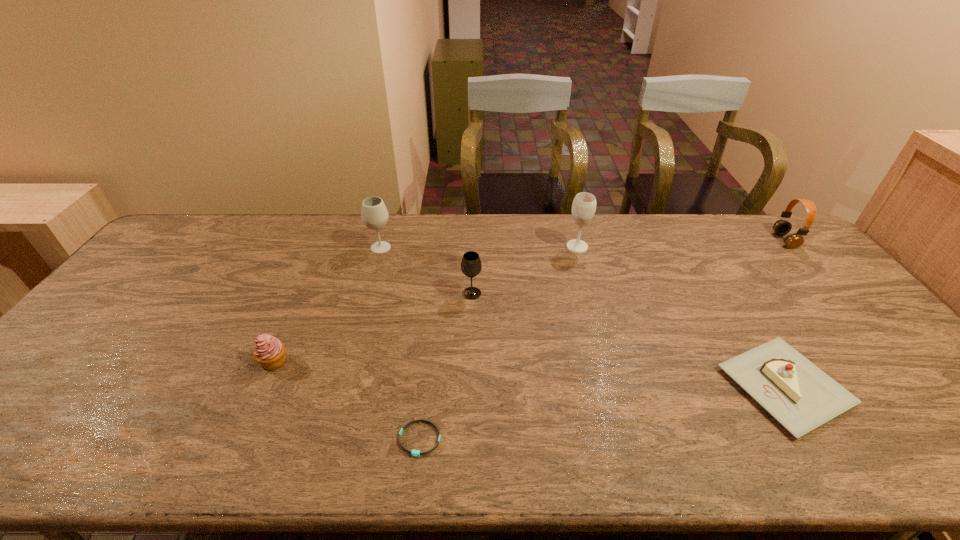
This screenshot has width=960, height=540. What are the coordinates of `wineglass that is the third nearest to the third shortest object` in the screenshot? It's located at (584, 204).

The width and height of the screenshot is (960, 540). What are the coordinates of `vacant space that satisfies the following two spatial constraints: 1. on the ear cups of the rightmost object; 2. on the front side of the fourth farthest object` in the screenshot? It's located at (830, 293).

At what (x,y) coordinates should I click in order to perform the action: click on vacant space that satisfies the following two spatial constraints: 1. on the front side of the second shortest object; 2. on the right side of the fourth object from right to left. Please return your answer as a coordinate pair (x, y). This screenshot has width=960, height=540. Looking at the image, I should click on (469, 387).

Where is `vacant space that satisfies the following two spatial constraints: 1. on the front side of the cupcake; 2. on the right side of the second shortest object`? This screenshot has width=960, height=540. vacant space that satisfies the following two spatial constraints: 1. on the front side of the cupcake; 2. on the right side of the second shortest object is located at coordinates (263, 387).

Where is `vacant space that satisfies the following two spatial constraints: 1. on the ear cups of the headset; 2. on the front side of the rightmost wineglass`? The width and height of the screenshot is (960, 540). vacant space that satisfies the following two spatial constraints: 1. on the ear cups of the headset; 2. on the front side of the rightmost wineglass is located at coordinates (791, 247).